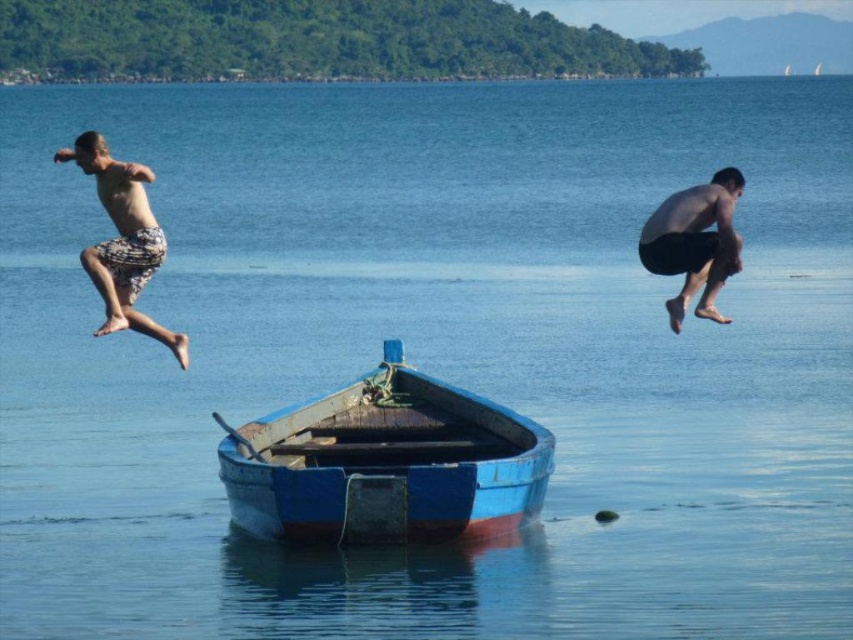
Who is positioned more to the right, blue wooden boat at center or black matte shorts at right?

From the viewer's perspective, black matte shorts at right appears more on the right side.

Does blue wooden boat at center have a smaller size compared to black matte shorts at right?

Yes, blue wooden boat at center is smaller than black matte shorts at right.

Is point (410, 380) positioned after point (643, 248)?

Yes, it is.

At what (x,y) coordinates should I click in order to perform the action: click on blue wooden boat at center. Please return your answer as a coordinate pair (x, y). Image resolution: width=853 pixels, height=640 pixels. Looking at the image, I should click on (386, 464).

The width and height of the screenshot is (853, 640). What do you see at coordinates (386, 464) in the screenshot? I see `blue wooden boat at center` at bounding box center [386, 464].

At what (x,y) coordinates should I click in order to perform the action: click on blue wooden boat at center. Please return your answer as a coordinate pair (x, y). The height and width of the screenshot is (640, 853). Looking at the image, I should click on (386, 464).

Does point (329, 406) come closer to viewer compared to point (90, 172)?

No.

At what (x,y) coordinates should I click in order to perform the action: click on blue wooden boat at center. Please return your answer as a coordinate pair (x, y). Looking at the image, I should click on (386, 464).

Looking at this image, who is higher up, printed shorts man at left or black matte shorts at right?

black matte shorts at right is above.

Does printed shorts man at left have a greater width compared to black matte shorts at right?

Incorrect, printed shorts man at left's width does not surpass black matte shorts at right's.

Is point (125, 317) positioned behind point (650, 262)?

No, it is in front of (650, 262).

Locate an element on the screen. printed shorts man at left is located at coordinates (123, 241).